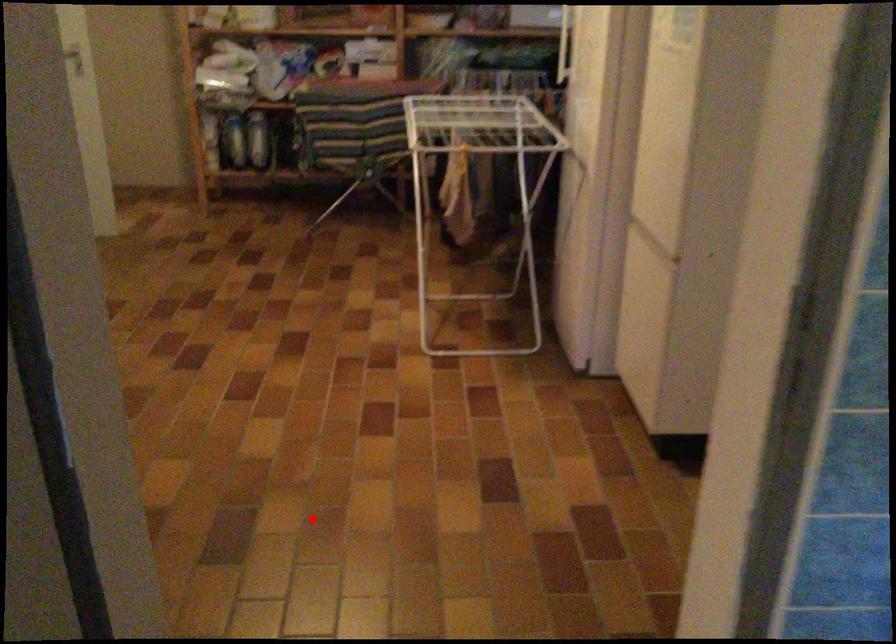
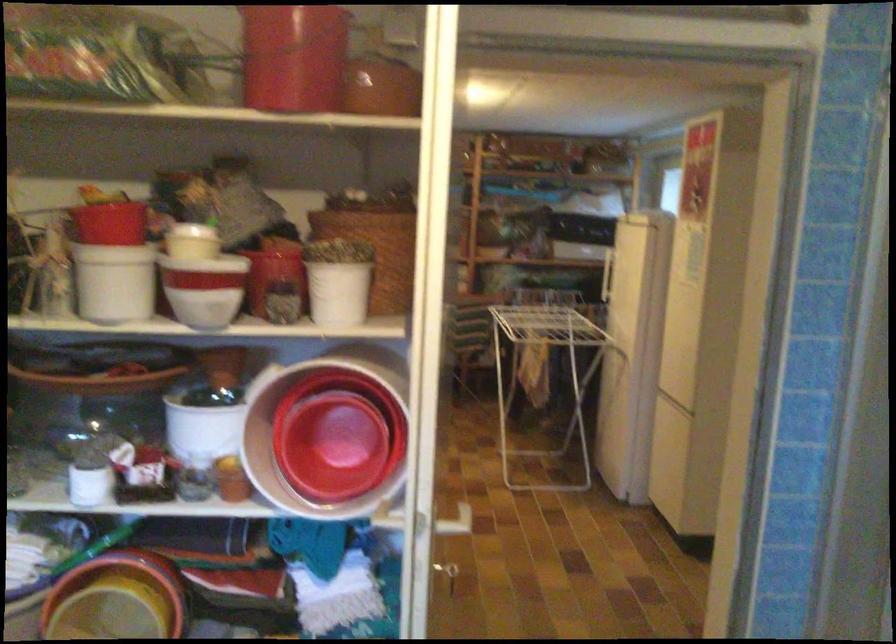
Locate, in the second image, the point that corresponds to the highlighted location in the first image.

(449, 574)